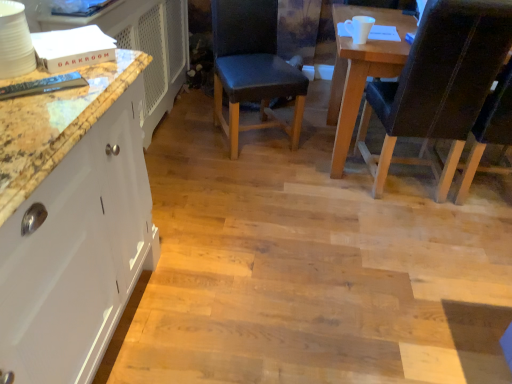
I want to click on free space in front of leather-like black chair at right, positioned as the 1th chair in right-to-left order, so click(x=421, y=241).